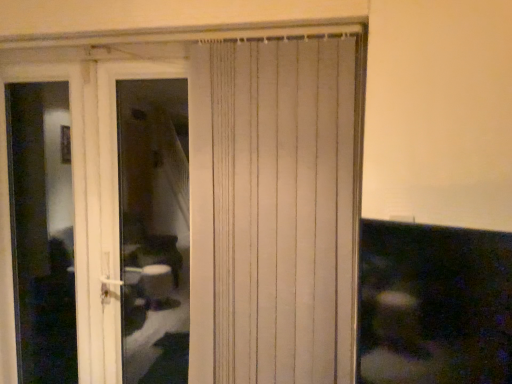
Question: From a real-world perspective, does transparent glass screen door at left sit lower than white plastic door at left?

Choices:
 (A) yes
 (B) no

Answer: (A)

Question: Is the depth of transparent glass screen door at left less than that of white plastic door at left?

Choices:
 (A) no
 (B) yes

Answer: (A)

Question: Does transparent glass screen door at left appear on the right side of white plastic door at left?

Choices:
 (A) yes
 (B) no

Answer: (B)

Question: Is transparent glass screen door at left to the left of white plastic door at left from the viewer's perspective?

Choices:
 (A) yes
 (B) no

Answer: (A)

Question: Is transparent glass screen door at left positioned with its back to white plastic door at left?

Choices:
 (A) no
 (B) yes

Answer: (A)

Question: Does transparent glass screen door at left have a lesser width compared to white plastic door at left?

Choices:
 (A) yes
 (B) no

Answer: (A)

Question: Is white textured curtain at center thinner than white plastic door at left?

Choices:
 (A) yes
 (B) no

Answer: (A)

Question: Considering the relative positions of white textured curtain at center and white plastic door at left in the image provided, is white textured curtain at center behind white plastic door at left?

Choices:
 (A) no
 (B) yes

Answer: (A)

Question: Does white textured curtain at center have a larger size compared to white plastic door at left?

Choices:
 (A) no
 (B) yes

Answer: (B)

Question: Is white plastic door at left inside white textured curtain at center?

Choices:
 (A) no
 (B) yes

Answer: (A)

Question: Is white textured curtain at center closer to camera compared to white plastic door at left?

Choices:
 (A) no
 (B) yes

Answer: (B)

Question: Is white textured curtain at center not within white plastic door at left?

Choices:
 (A) no
 (B) yes

Answer: (B)

Question: Is white plastic door at left shorter than transparent glass screen door at left?

Choices:
 (A) yes
 (B) no

Answer: (A)